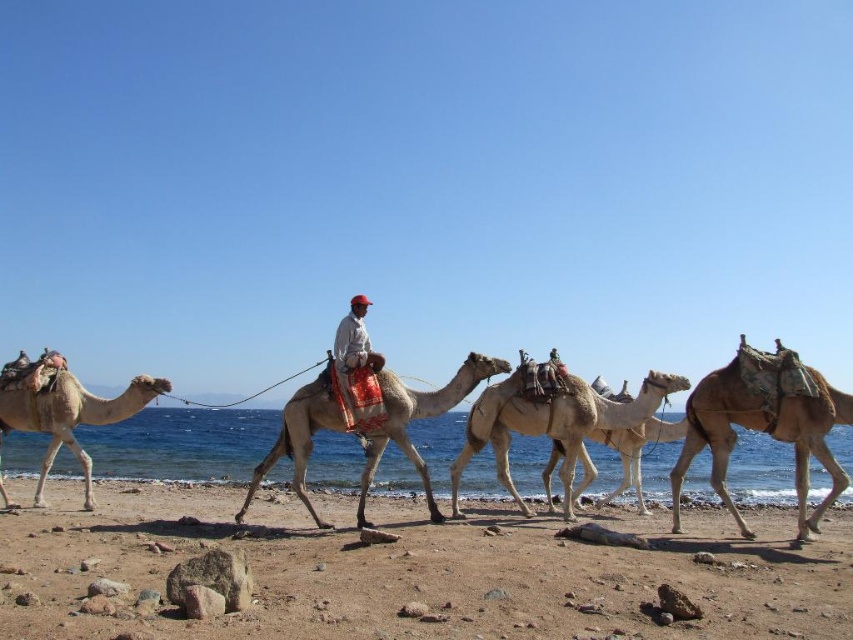
Between light brown textured camel at right and light beige textured camel at center, which one is positioned lower?

Positioned lower is light brown textured camel at right.

Is light brown textured camel at right further to camera compared to light beige textured camel at center?

No, light brown textured camel at right is in front of light beige textured camel at center.

Where is `light brown textured camel at right`? light brown textured camel at right is located at coordinates (763, 424).

Who is more forward, [28,616] or [583,394]?

Positioned in front is point [28,616].

Between brown sandy beach at lower center and light beige textured camel at center, which one appears on the right side from the viewer's perspective?

Positioned to the right is light beige textured camel at center.

Is point (286, 592) more distant than point (564, 422)?

No, (286, 592) is in front of (564, 422).

Where is `brown sandy beach at lower center`? This screenshot has height=640, width=853. brown sandy beach at lower center is located at coordinates 418,572.

Between point (419, 468) and point (26, 422), which one is positioned behind?

Point (26, 422)

Who is shorter, light brown textured camel at center or light beige sand-colored camel at left?

With less height is light brown textured camel at center.

Between point (389, 432) and point (13, 422), which one is positioned behind?

Positioned behind is point (13, 422).

The image size is (853, 640). What are the coordinates of `light brown textured camel at center` in the screenshot? It's located at (416, 419).